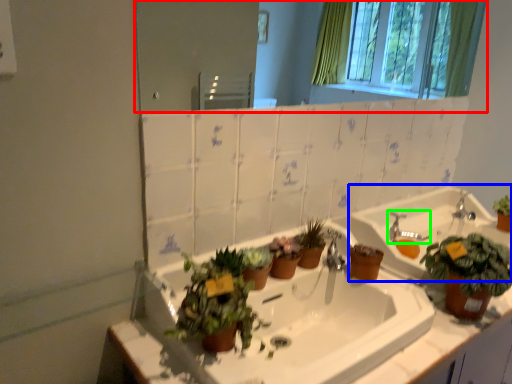
Question: Based on their relative distances, which object is nearer to mirror (highlighted by a red box)? Choose from sink (highlighted by a blue box) and faucet (highlighted by a green box).

Choices:
 (A) sink
 (B) faucet

Answer: (A)